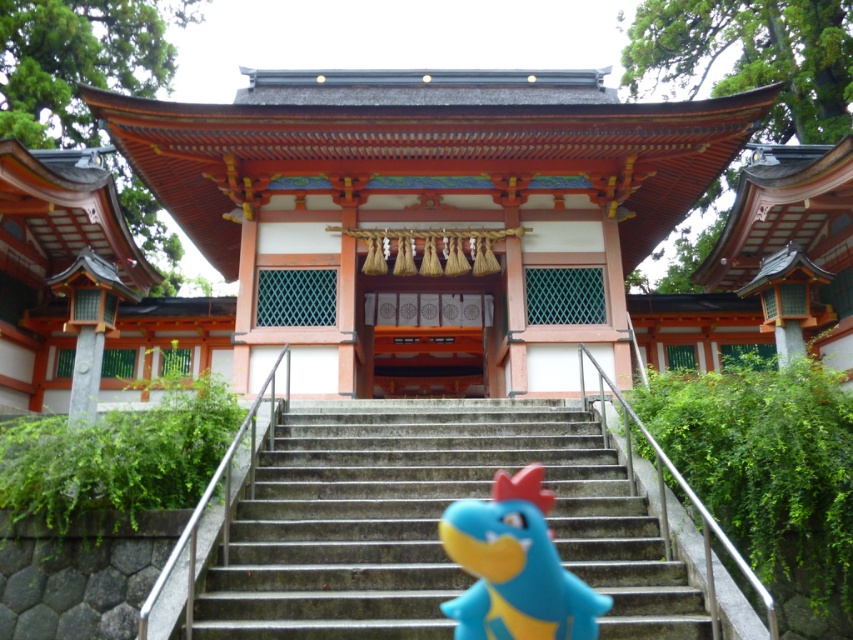
You are a visitor approaching the shrine and see the blue rubber toy at center and the concrete stairs at center. Which object is closer to you as you stand at the base of the shrine?

The concrete stairs at center are closer to you because the blue rubber toy at center is positioned behind them.